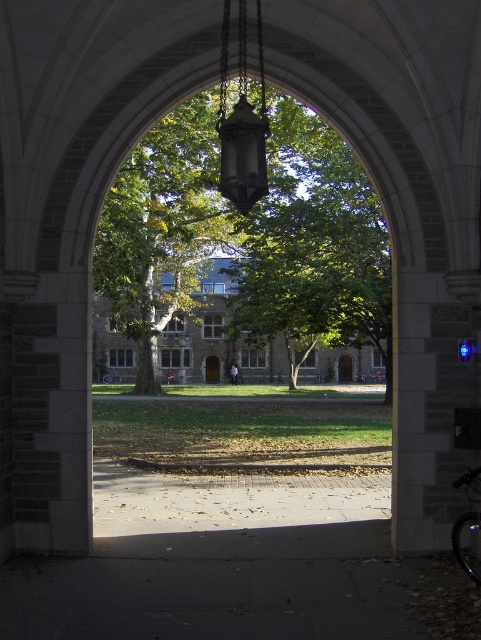
Between green leafy tree at center and matte black lantern at center, which one is positioned lower?

Positioned lower is green leafy tree at center.

The height and width of the screenshot is (640, 481). Find the location of `green leafy tree at center`. green leafy tree at center is located at coordinates (248, 237).

Image resolution: width=481 pixels, height=640 pixels. In order to click on green leafy tree at center in this screenshot , I will do `click(248, 237)`.